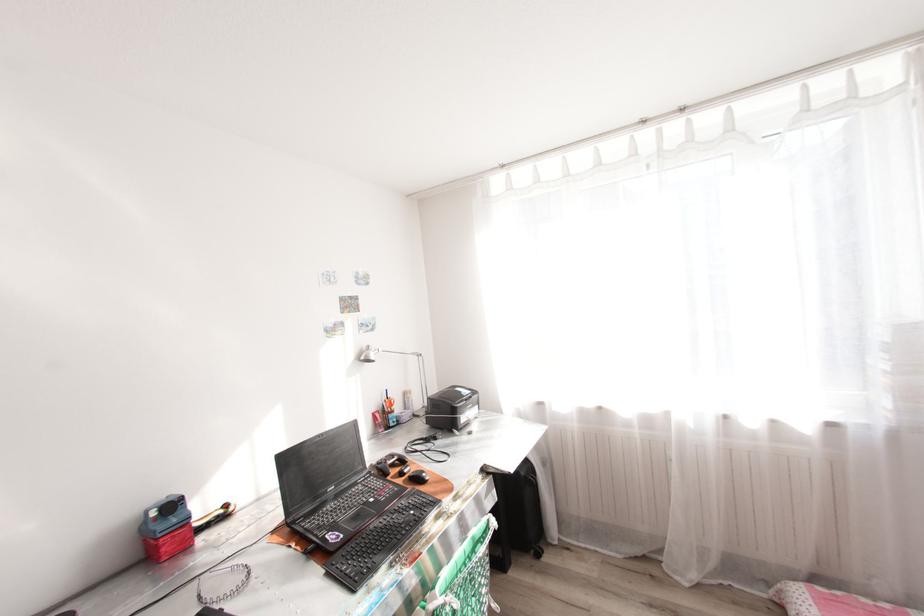
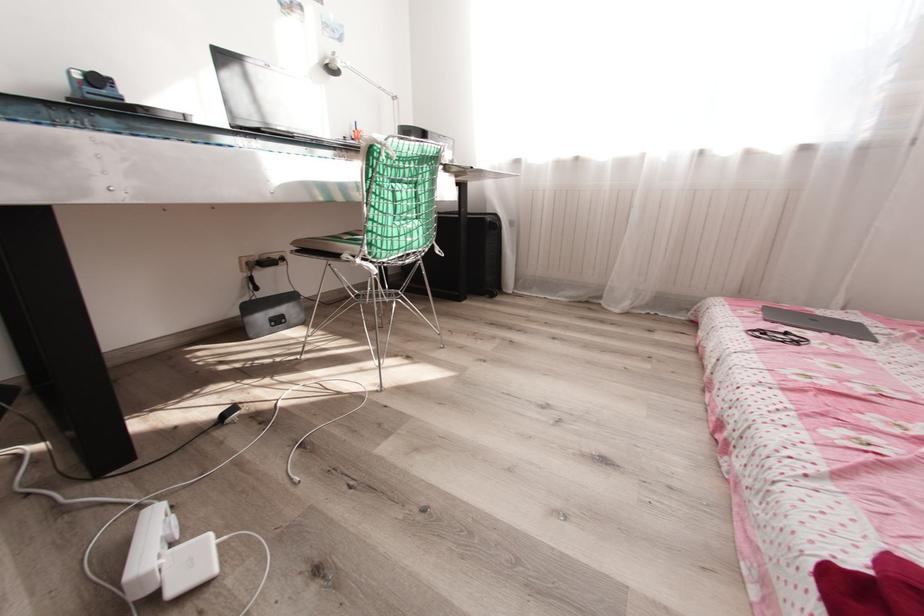
Question: Based on the continuous images, in which direction is the camera rotating? Reply with the corresponding letter.

Choices:
 (A) Left
 (B) Right
 (C) Up
 (D) Down

Answer: (D)